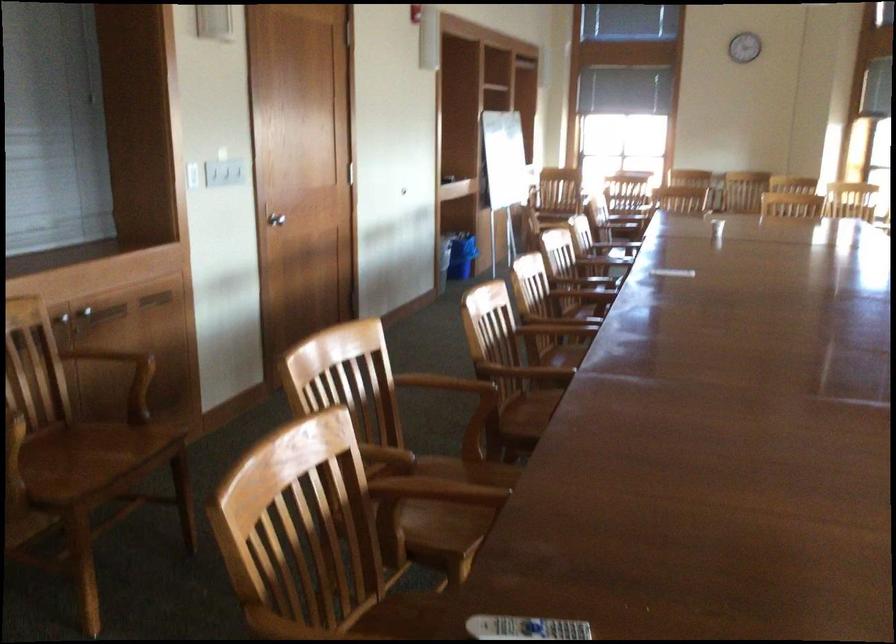
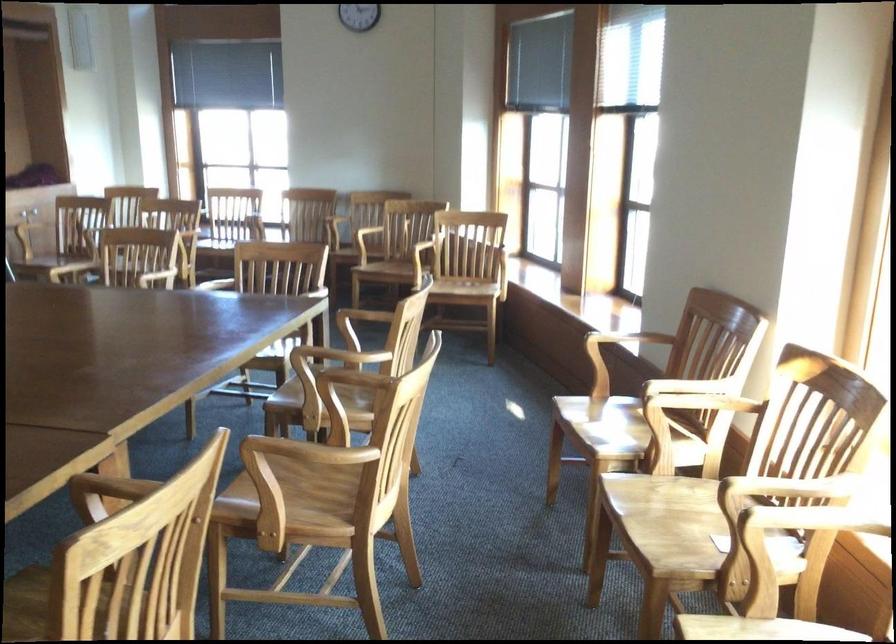
In a continuous first-person perspective shot, in which direction is the camera moving?

The cameraman moved toward right, forward.